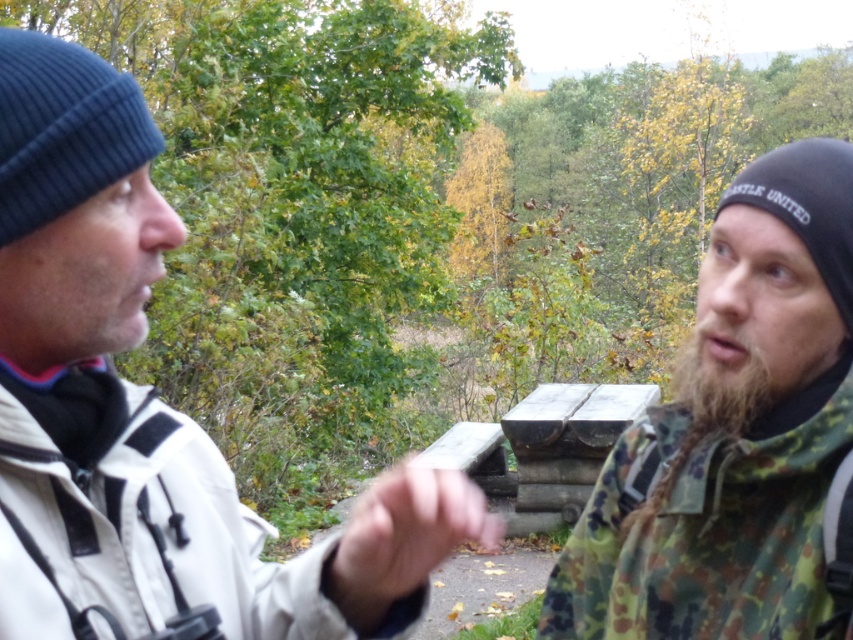
Question: Which point is farther from the camera taking this photo?

Choices:
 (A) (15, 328)
 (B) (712, 371)
 (C) (422, 548)
 (D) (711, 451)

Answer: (D)

Question: Can you confirm if camouflage fabric hand at center is positioned above brown fuzzy beard at right?

Choices:
 (A) no
 (B) yes

Answer: (A)

Question: Based on their relative distances, which object is farther from the brown fuzzy beard at right?

Choices:
 (A) white matte jacket at left
 (B) camouflage jacket at right

Answer: (A)

Question: Can you confirm if white matte jacket at left is positioned below camouflage jacket at right?

Choices:
 (A) no
 (B) yes

Answer: (A)

Question: Does white matte jacket at left come in front of brown fuzzy beard at right?

Choices:
 (A) yes
 (B) no

Answer: (A)

Question: Which point is farther to the camera?

Choices:
 (A) white matte jacket at left
 (B) camouflage jacket at right
 (C) camouflage fabric hand at center

Answer: (B)